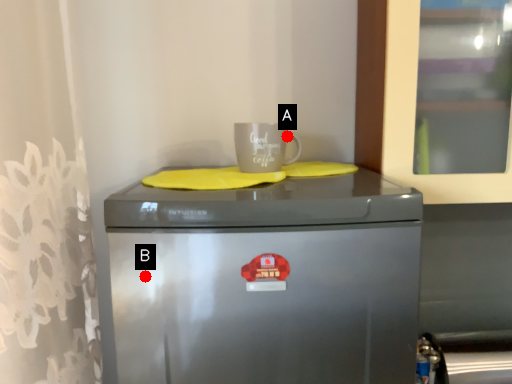
Question: Two points are circled on the image, labeled by A and B beside each circle. Which of the following is the closest to the observer?

Choices:
 (A) A is closer
 (B) B is closer

Answer: (B)